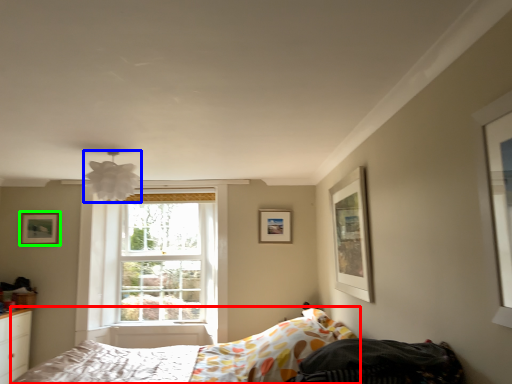
Question: Based on their relative distances, which object is nearer to bed (highlighted by a red box)? Choose from lamp (highlighted by a blue box) and picture frame (highlighted by a green box).

Choices:
 (A) lamp
 (B) picture frame

Answer: (A)